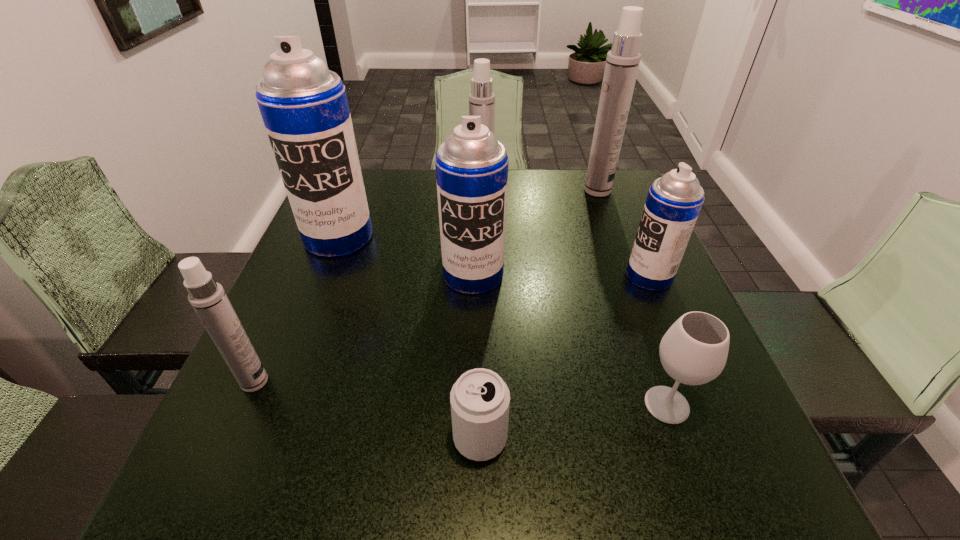
Locate an element on the screen. Image resolution: width=960 pixels, height=540 pixels. wineglass present at the right edge is located at coordinates (x=694, y=350).

Find the location of a particular element. object located in the far right corner section of the desktop is located at coordinates (622, 62).

At what (x,y) coordinates should I click in order to perform the action: click on vacant area at the near edge. Please return your answer as a coordinate pair (x, y). This screenshot has width=960, height=540. Looking at the image, I should click on (644, 468).

In the image, there is a desktop. At what (x,y) coordinates should I click in order to perform the action: click on free region at the left edge. Please return your answer as a coordinate pair (x, y). The image size is (960, 540). Looking at the image, I should click on (326, 301).

I want to click on free spot at the right edge of the desktop, so click(603, 231).

Locate an element on the screen. The height and width of the screenshot is (540, 960). blank space at the near right corner of the desktop is located at coordinates (681, 483).

Identify the location of vacant region between the second blue aerosol can from right to left and the leftmost white aerosol can. (364, 328).

Where is `free space between the second white aerosol can from right to left and the leftmost white aerosol can`? The width and height of the screenshot is (960, 540). free space between the second white aerosol can from right to left and the leftmost white aerosol can is located at coordinates (368, 292).

Find the location of a particular element. The image size is (960, 540). free space between the nearest white aerosol can and the second smallest white aerosol can is located at coordinates (368, 292).

Find the location of `free space between the nearest white aerosol can and the second biggest blue aerosol can`. free space between the nearest white aerosol can and the second biggest blue aerosol can is located at coordinates (364, 328).